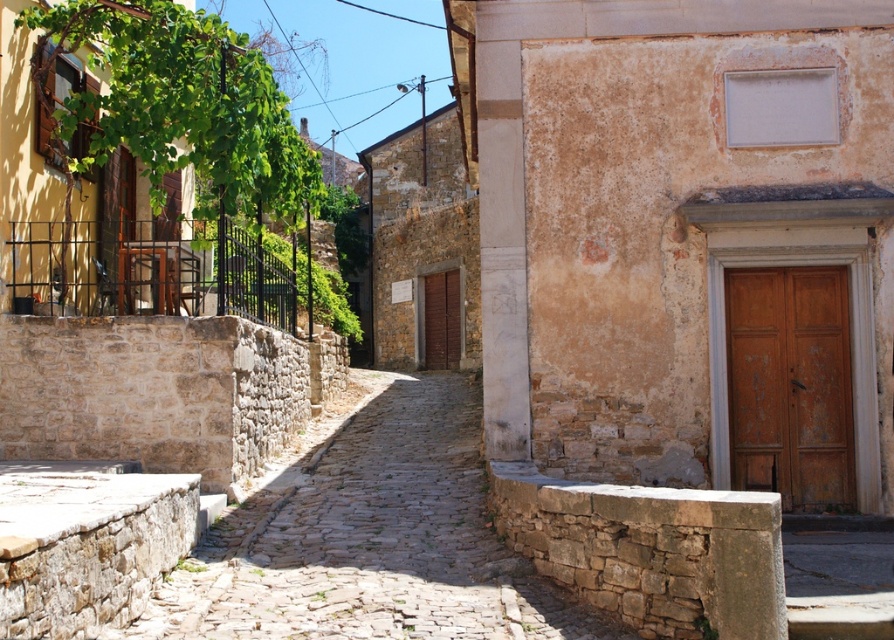
Question: Which of the following is the closest to the observer?

Choices:
 (A) (808, 481)
 (B) (434, 284)

Answer: (A)

Question: Considering the relative positions of wooden door at right and brown wooden door at center in the image provided, where is wooden door at right located with respect to brown wooden door at center?

Choices:
 (A) left
 (B) right

Answer: (B)

Question: Is wooden door at right to the right of brown wooden door at center from the viewer's perspective?

Choices:
 (A) yes
 (B) no

Answer: (A)

Question: Which object is closer to the camera taking this photo?

Choices:
 (A) brown wooden door at center
 (B) wooden door at right

Answer: (B)

Question: Is the position of wooden door at right more distant than that of brown wooden door at center?

Choices:
 (A) no
 (B) yes

Answer: (A)